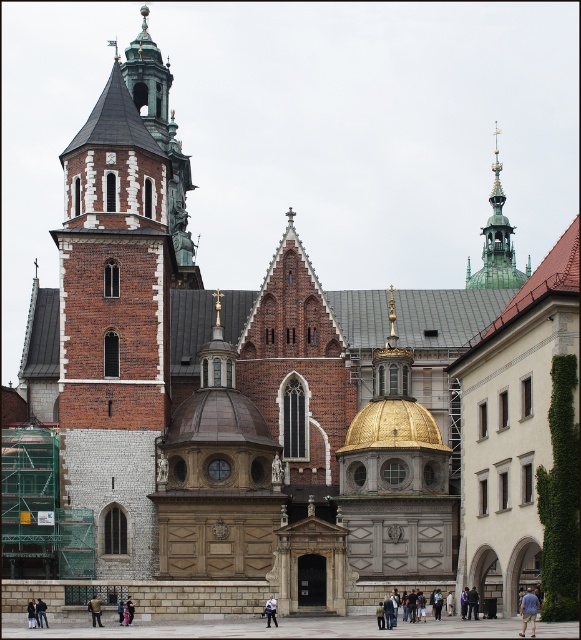
Question: Is green-golden metal spire at upper center smaller than blue cotton shirt at lower right?

Choices:
 (A) no
 (B) yes

Answer: (A)

Question: Can you confirm if blue cotton shirt at lower right is positioned to the right of dark blue jeans at lower center?

Choices:
 (A) no
 (B) yes

Answer: (B)

Question: Which is nearer to the light blue jeans at center?

Choices:
 (A) green-golden metal spire at upper center
 (B) light brown leather jacket at lower center
 (C) light blue denim jeans at lower center

Answer: (C)

Question: Which point is farther from the camera taking this photo?

Choices:
 (A) (270, 611)
 (B) (433, 598)
 (C) (496, 202)

Answer: (C)

Question: Does blue cotton shirt at lower right appear on the left side of dark gray fabric jacket at lower center?

Choices:
 (A) no
 (B) yes

Answer: (A)

Question: Which point is closer to the camera taking this photo?

Choices:
 (A) (442, 604)
 (B) (272, 604)
 (C) (493, 221)
 (D) (27, 605)

Answer: (B)